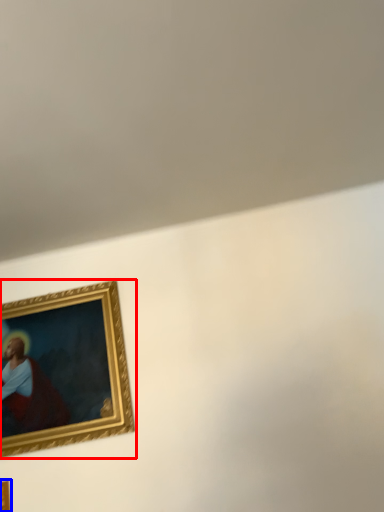
Question: Which object appears closest to the camera in this image, picture frame (highlighted by a red box) or picture frame (highlighted by a blue box)?

Choices:
 (A) picture frame
 (B) picture frame

Answer: (B)